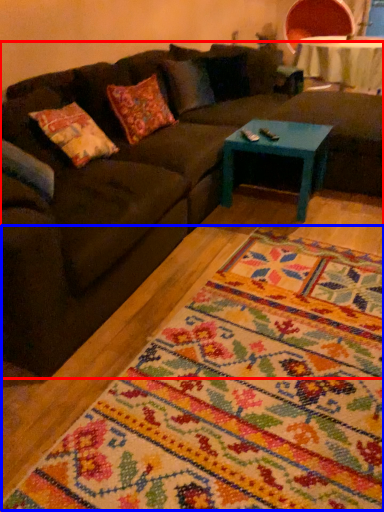
Question: Among these objects, which one is farthest to the camera, studio couch (highlighted by a red box) or mat (highlighted by a blue box)?

Choices:
 (A) studio couch
 (B) mat

Answer: (A)